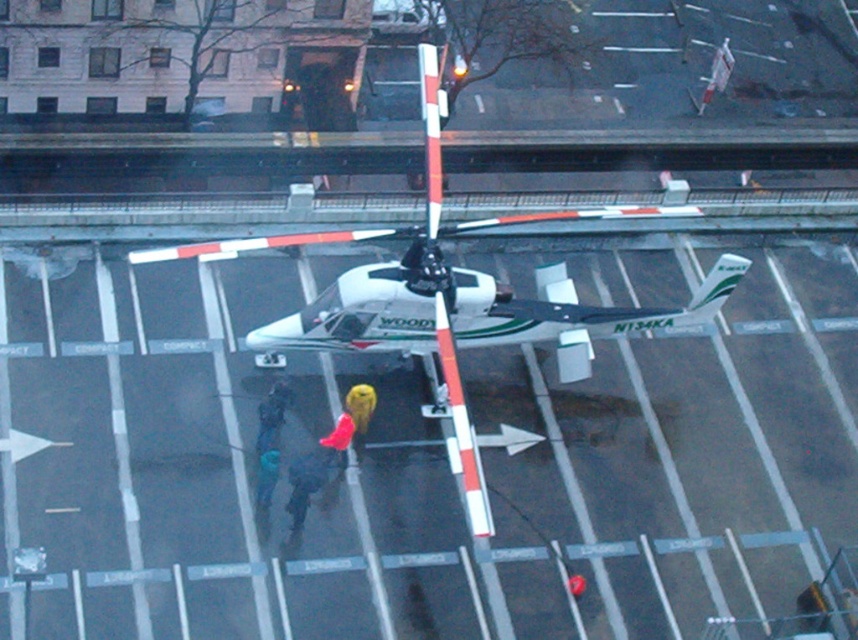
Question: Can you confirm if white glossy tarmac at center is positioned above white matte helicopter at center?

Choices:
 (A) no
 (B) yes

Answer: (A)

Question: Does white glossy tarmac at center lie in front of white matte helicopter at center?

Choices:
 (A) no
 (B) yes

Answer: (A)

Question: Is white glossy tarmac at center smaller than white matte helicopter at center?

Choices:
 (A) no
 (B) yes

Answer: (B)

Question: Among these points, which one is nearest to the camera?

Choices:
 (A) (606, 324)
 (B) (74, 449)

Answer: (B)